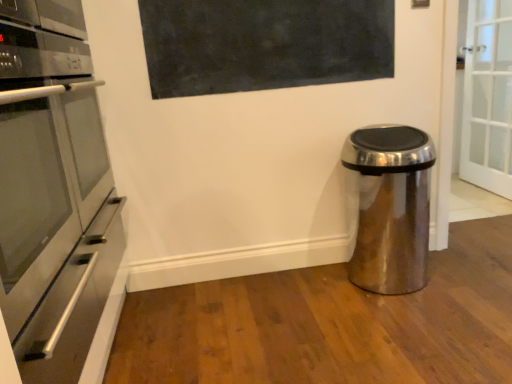
Locate an element on the screen. Image resolution: width=512 pixels, height=384 pixels. unoccupied region to the right of satin metallic trash can at lower right is located at coordinates (466, 279).